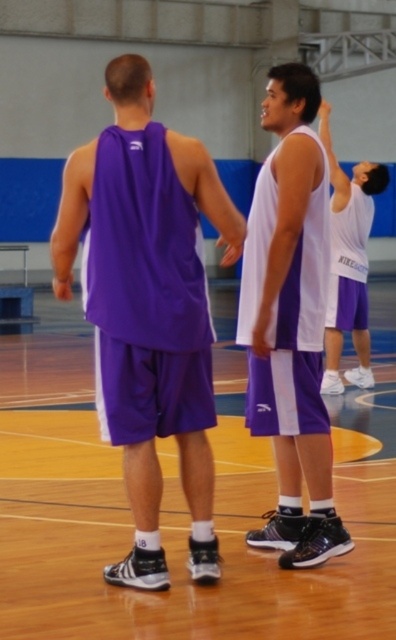
Based on the coordinates provided, which object is located at point [291,321] in the basketball court scene?

The point [291,321] corresponds to the white matte tank top at center.

You are a photographer setting up for a sports event. You need to position a light to the right of the white matte basketball jersey at upper right. Will the light also be to the right of the white matte tank top at center?

The white matte tank top at center is to the left of the white matte basketball jersey at upper right, so placing the light to the right of the jersey would also place it to the right of the tank top.

Looking at this image, you are a photographer setting up for a basketball game. You need to position a camera to capture both the white matte tank top at center and the white matte basketball jersey at upper right. Which object should you focus on first if you want to prioritize the one that is closer to the camera?

The white matte basketball jersey at upper right is closer to the camera than the white matte tank top at center, so you should focus on the white matte basketball jersey at upper right first.